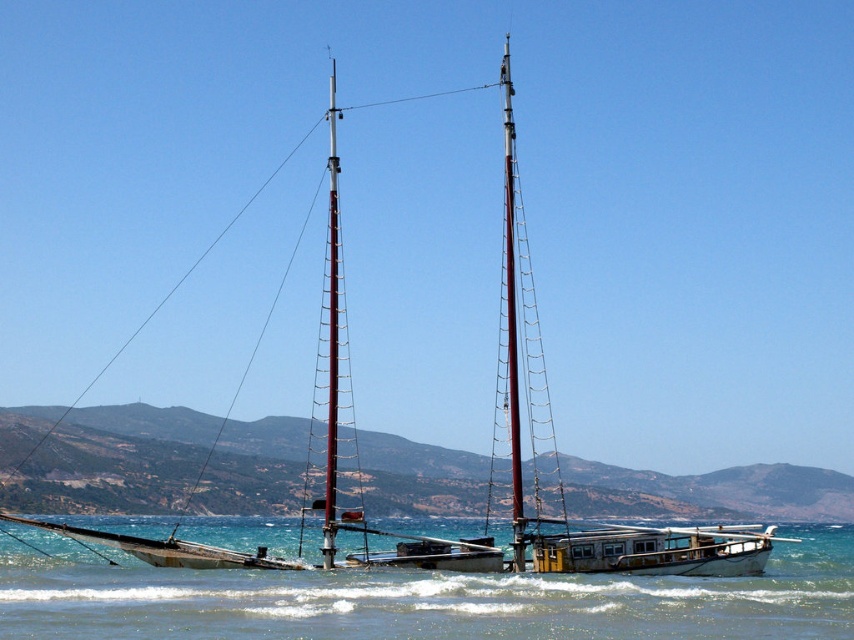
Can you confirm if clear blue water at center is thinner than metallic red mast at center?

In fact, clear blue water at center might be wider than metallic red mast at center.

Is clear blue water at center below metallic red mast at center?

Yes, clear blue water at center is below metallic red mast at center.

Find the location of a particular element. clear blue water at center is located at coordinates (419, 598).

Between point (507, 83) and point (332, 500), which one is positioned behind?

The point (507, 83) is behind.

Who is lower down, smooth wood mast at center or metallic red mast at center?

smooth wood mast at center is below.

Locate an element on the screen. The image size is (854, 640). smooth wood mast at center is located at coordinates (512, 314).

Find the location of a particular element. This screenshot has width=854, height=640. smooth wood mast at center is located at coordinates (512, 314).

Is clear blue water at center to the left of smooth wood mast at center from the viewer's perspective?

Incorrect, clear blue water at center is not on the left side of smooth wood mast at center.

Which is behind, point (244, 636) or point (516, 512)?

The point (516, 512) is behind.

Is point (548, 577) in front of point (512, 358)?

Yes, it is.

Identify the location of clear blue water at center. (419, 598).